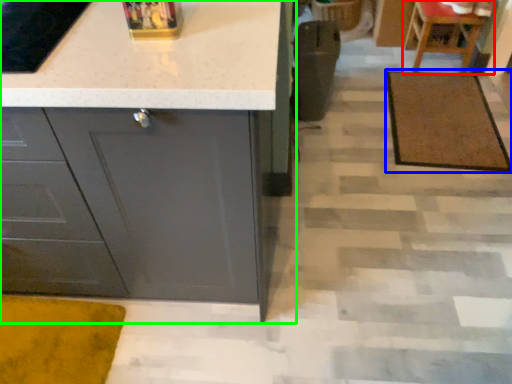
Question: Estimate the real-world distances between objects in this image. Which object is farther from chair (highlighted by a red box), doormat (highlighted by a blue box) or cabinetry (highlighted by a green box)?

Choices:
 (A) doormat
 (B) cabinetry

Answer: (B)